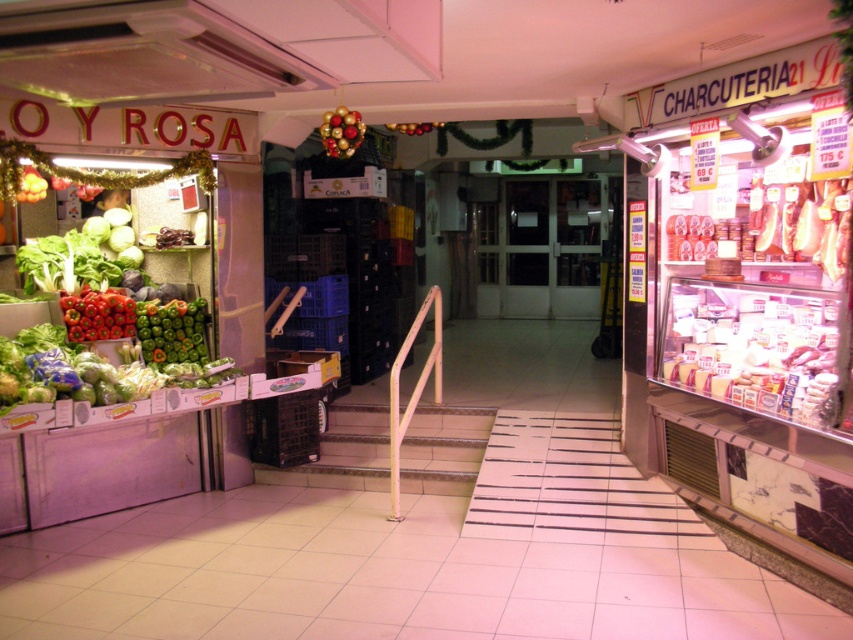
You are a customer in the market and want to find the red matte bell peppers at left. According to the store layout, where exactly are they located?

The red matte bell peppers at left are located at point (97,314) in the store layout.

You are a customer in the market and want to buy a bell pepper for a recipe that requires a larger size. Which one should you choose between the green matte bell peppers at left and the red matte bell peppers at left?

The red matte bell peppers at left are larger in size compared to the green matte bell peppers at left, so you should choose the red matte bell peppers at left for your recipe.

You are a customer in the market holding a shopping basket that is 0.5 meters wide. You want to pick up the red matte bell peppers at left and place them in your basket which is near the glossy red apples at center. Can you fit the peppers into your basket without moving the apples?

The distance between the red matte bell peppers at left and the glossy red apples at center is 3.07 meters. Since your basket is only 0.5 meters wide, you will need to move the peppers or the apples closer to fit them together.